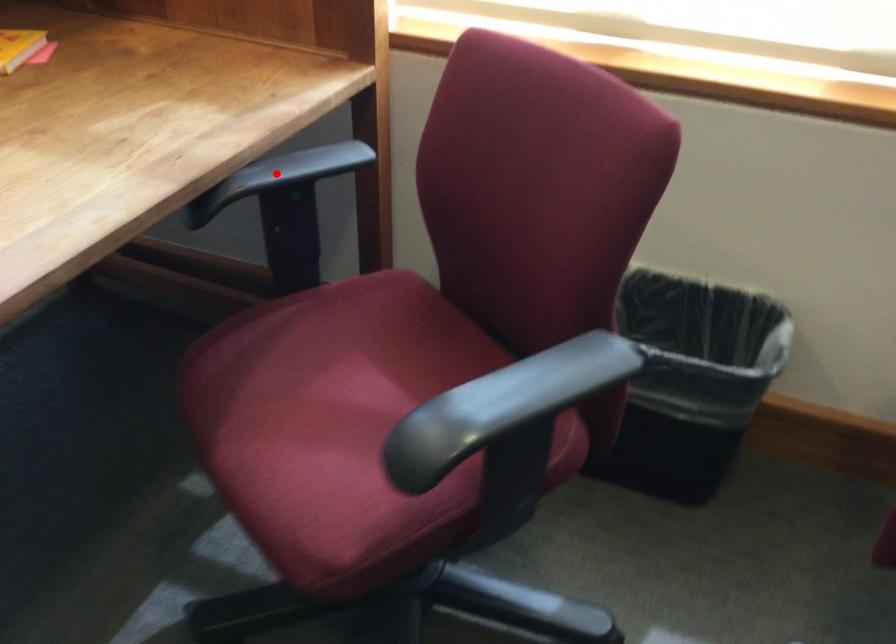
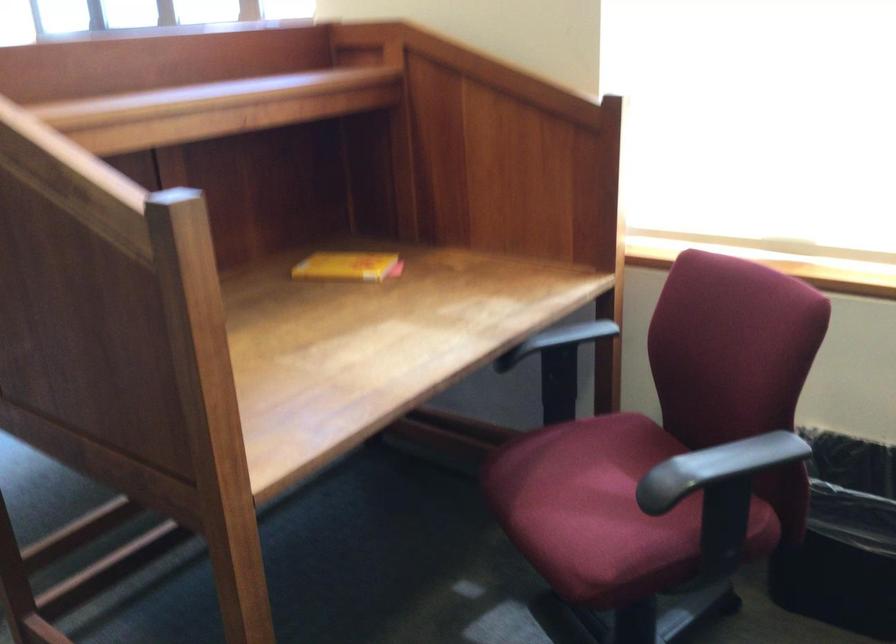
Where in the second image is the point corresponding to the highlighted location from the first image?

(556, 339)